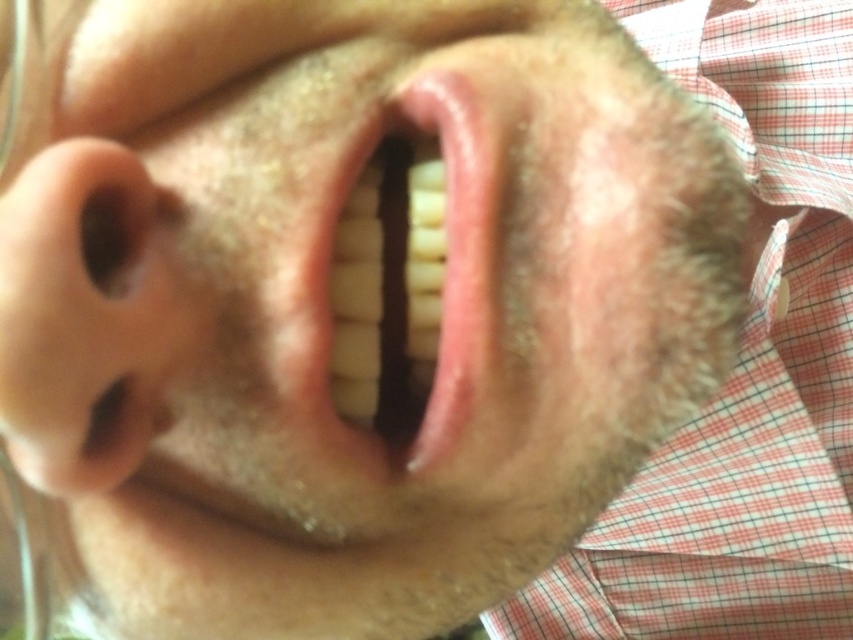
Question: Based on their relative distances, which object is farther from the pink flesh-colored nose at left?

Choices:
 (A) glossy pink lips at center
 (B) red checkered fabric at right

Answer: (B)

Question: Does red checkered fabric at right appear on the right side of pink flesh-colored nose at left?

Choices:
 (A) no
 (B) yes

Answer: (B)

Question: Which point is closer to the camera taking this photo?

Choices:
 (A) (809, 163)
 (B) (137, 284)

Answer: (B)

Question: Can you confirm if pink flesh-colored nose at left is thinner than glossy pink lips at center?

Choices:
 (A) no
 (B) yes

Answer: (A)

Question: Is red checkered fabric at right to the left of glossy pink lips at center from the viewer's perspective?

Choices:
 (A) yes
 (B) no

Answer: (B)

Question: Which of the following is the closest to the observer?

Choices:
 (A) (779, 337)
 (B) (155, 209)

Answer: (B)